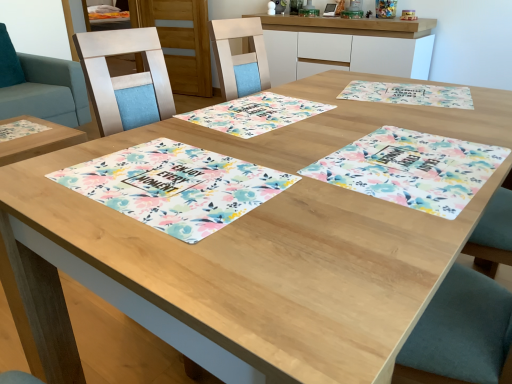
You are a GUI agent. You are given a task and a screenshot of the screen. Output one action in this format:
    pyautogui.click(x=<x>, y=<y>)
    Task: Click on the free spot in front of floral fabric placemat at center, the 1th place mat when ordered from left to right
    
    Given the screenshot: What is the action you would take?
    pyautogui.click(x=209, y=265)